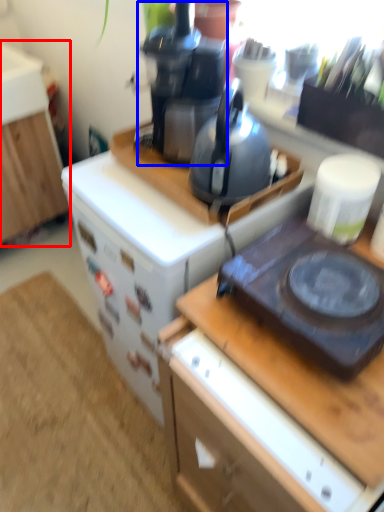
Question: Which object appears farthest to the camera in this image, cabinetry (highlighted by a red box) or coffeepot (highlighted by a blue box)?

Choices:
 (A) cabinetry
 (B) coffeepot

Answer: (A)